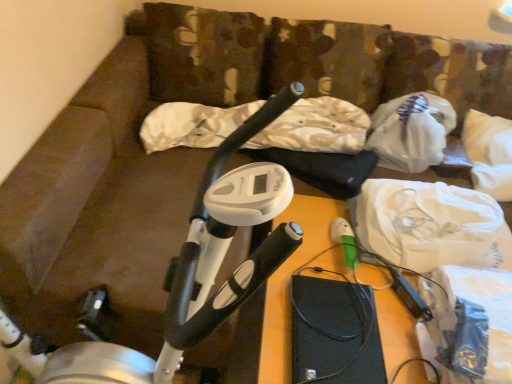
Describe the element at coordinates (430, 225) in the screenshot. I see `white fabric at upper right` at that location.

The image size is (512, 384). I want to click on white fabric at upper right, so click(430, 225).

Locate an element on the screen. This screenshot has width=512, height=384. white plastic bag at upper right is located at coordinates (411, 132).

Considering the relative positions of white fabric at upper right and white plastic bag at upper right in the image provided, is white fabric at upper right to the right of white plastic bag at upper right from the viewer's perspective?

No.

Which of these two, white fabric at upper right or white plastic bag at upper right, is thinner?

white plastic bag at upper right is thinner.

Is white fabric at upper right positioned far away from white plastic bag at upper right?

No, there isn't a large distance between white fabric at upper right and white plastic bag at upper right.

Is white plastic stationary bicycle at left next to white plastic bag at upper right and touching it?

white plastic stationary bicycle at left and white plastic bag at upper right are clearly separated.

Is white plastic stationary bicycle at left oriented away from white plastic bag at upper right?

No.

Locate an element on the screen. This screenshot has height=384, width=512. plastic bag below the white plastic stationary bicycle at left (from a real-world perspective) is located at coordinates (411, 132).

Find the location of a particular element. The width and height of the screenshot is (512, 384). material above the white plastic stationary bicycle at left (from the image's perspective) is located at coordinates (430, 225).

Is white plastic stationary bicycle at left not close to white fabric at upper right?

That's not correct — white plastic stationary bicycle at left is a little close to white fabric at upper right.

What's the angular difference between white plastic stationary bicycle at left and white fabric at upper right's facing directions?

90.3 degrees.

Is white plastic stationary bicycle at left facing away from white fabric at upper right?

white plastic stationary bicycle at left does not have its back to white fabric at upper right.

Considering the points (444, 222) and (36, 367), which point is in front, point (444, 222) or point (36, 367)?

The point (36, 367) is more forward.

Between white fabric at upper right and white plastic stationary bicycle at left, which one has less height?

With less height is white fabric at upper right.

Is white fabric at upper right completely or partially outside of white plastic stationary bicycle at left?

That's correct, white fabric at upper right is outside of white plastic stationary bicycle at left.

How far apart are white plastic bag at upper right and white fabric at upper right?

white plastic bag at upper right is 14.50 inches from white fabric at upper right.

Is white plastic bag at upper right bigger than white fabric at upper right?

No.

Between white plastic bag at upper right and white fabric at upper right, which one is positioned in front?

white fabric at upper right is more forward.

Does white plastic bag at upper right have a greater width compared to white fabric at upper right?

No, white plastic bag at upper right is not wider than white fabric at upper right.

Is white plastic bag at upper right located outside white plastic stationary bicycle at left?

Yes, white plastic bag at upper right is outside of white plastic stationary bicycle at left.

Are white plastic bag at upper right and white plastic stationary bicycle at left beside each other?

There is a gap between white plastic bag at upper right and white plastic stationary bicycle at left.

In terms of height, does white plastic bag at upper right look taller or shorter compared to white plastic stationary bicycle at left?

Considering their sizes, white plastic bag at upper right has less height than white plastic stationary bicycle at left.

Where is `material that appears on the left of white plastic bag at upper right`? This screenshot has width=512, height=384. material that appears on the left of white plastic bag at upper right is located at coordinates (430, 225).

In order to click on stationary bicycle located below the white plastic bag at upper right (from the image's perspective) in this screenshot , I will do `click(188, 270)`.

In the scene shown: Estimate the real-world distances between objects in this image. Which object is further from white plastic stationary bicycle at left, white fabric at upper right or white plastic bag at upper right?

Based on the image, white plastic bag at upper right appears to be further to white plastic stationary bicycle at left.

In the scene shown: Looking at the image, which one is located further to white fabric at upper right, white plastic stationary bicycle at left or white plastic bag at upper right?

white plastic stationary bicycle at left lies further to white fabric at upper right than the other object.

Based on their spatial positions, is white plastic stationary bicycle at left or white fabric at upper right further from white plastic bag at upper right?

white plastic stationary bicycle at left lies further to white plastic bag at upper right than the other object.

From the image, which object appears to be nearer to white plastic bag at upper right, white fabric at upper right or white plastic stationary bicycle at left?

white fabric at upper right is positioned closer to the anchor white plastic bag at upper right.

Considering their positions, is white plastic bag at upper right positioned closer to white plastic stationary bicycle at left than white fabric at upper right?

white fabric at upper right.

Considering their positions, is white plastic bag at upper right positioned further to white fabric at upper right than white plastic stationary bicycle at left?

white plastic stationary bicycle at left is further to white fabric at upper right.

You are a GUI agent. You are given a task and a screenshot of the screen. Output one action in this format:
    pyautogui.click(x=<x>, y=<y>)
    Task: Click on the material positioned between white plastic stationary bicycle at left and white plastic bag at upper right from near to far
    
    Given the screenshot: What is the action you would take?
    pyautogui.click(x=430, y=225)